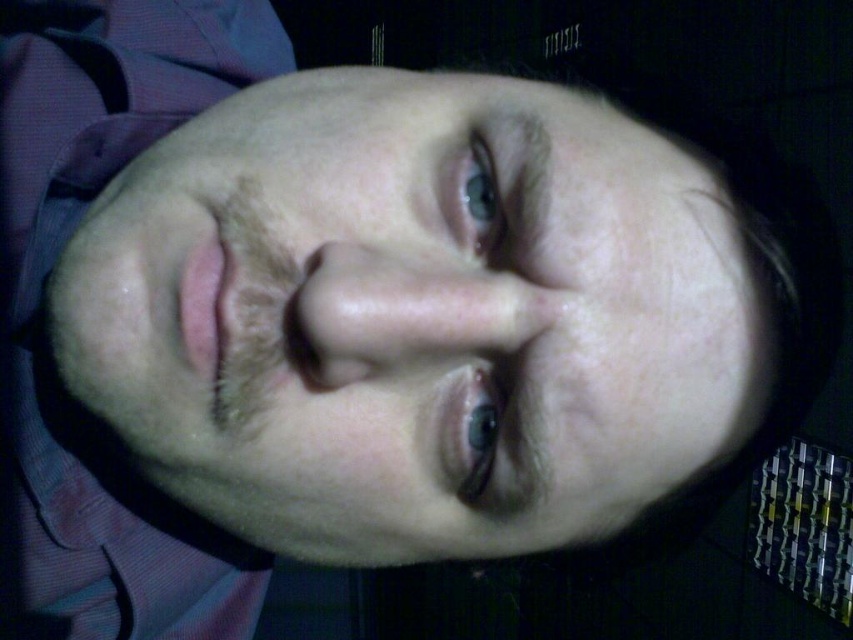
Measure the distance from pink fabric shirt at left to blue glossy eye at center.

pink fabric shirt at left and blue glossy eye at center are 10.86 inches apart from each other.

Is pink fabric shirt at left taller than blue glossy eye at center?

Indeed, pink fabric shirt at left has a greater height compared to blue glossy eye at center.

At what (x,y) coordinates should I click in order to perform the action: click on pink fabric shirt at left. Please return your answer as a coordinate pair (x, y). The width and height of the screenshot is (853, 640). Looking at the image, I should click on (44, 317).

Can you confirm if blue glossy eye at upper center is thinner than blue glossy eye at center?

No, blue glossy eye at upper center is not thinner than blue glossy eye at center.

Which is behind, point (486, 234) or point (465, 435)?

The point (486, 234) is more distant.

Find the location of a particular element. The width and height of the screenshot is (853, 640). blue glossy eye at upper center is located at coordinates coord(480,196).

Is smooth skin face at center below pink fabric shirt at left?

Yes, smooth skin face at center is below pink fabric shirt at left.

The width and height of the screenshot is (853, 640). I want to click on smooth skin face at center, so click(412, 316).

Which is in front, point (708, 188) or point (21, 19)?

Point (708, 188) is more forward.

Find the location of a particular element. This screenshot has width=853, height=640. smooth skin face at center is located at coordinates (412, 316).